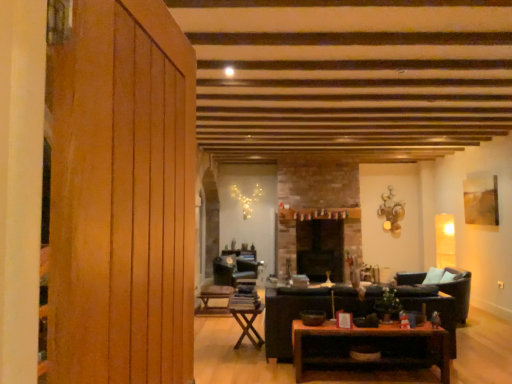
Question: Is point pyautogui.click(x=253, y=339) positioned closer to the camera than point pyautogui.click(x=450, y=317)?

Choices:
 (A) farther
 (B) closer

Answer: (A)

Question: From their relative heights in the image, would you say wooden folding table at center, which appears as the second table when viewed from the right, is taller or shorter than black leather couch at center?

Choices:
 (A) short
 (B) tall

Answer: (A)

Question: Which object is positioned farthest from the black leather couch at center?

Choices:
 (A) brown wooden table at center, the third table from the back
 (B) velvet dark green armchair at center, marked as the 1th armchair in a left-to-right arrangement
 (C) wooden paneling at left
 (D) wooden folding table at center, which appears as the second table when viewed from the right
 (E) wooden folding table at center, which is the 3th table from front to back

Answer: (C)

Question: Which of these objects is positioned closest to the wooden folding table at center, which ranks as the 1th table in left-to-right order?

Choices:
 (A) wooden folding table at center, the second table viewed from the left
 (B) dark brown leather armchair at right, which ranks as the 2th armchair in back-to-front order
 (C) wooden paneling at left
 (D) brown wooden table at center, the third table from the back
 (E) velvet dark green armchair at center, marked as the 1th armchair in a left-to-right arrangement

Answer: (E)